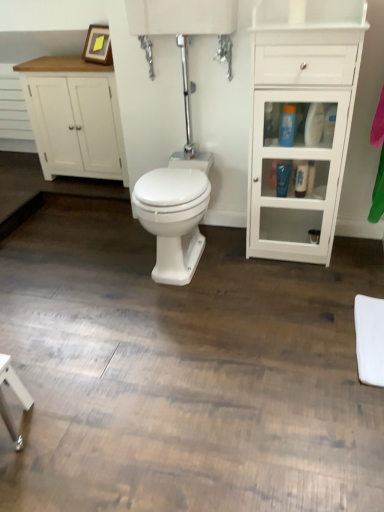
The height and width of the screenshot is (512, 384). I want to click on vacant space in front of white glossy cabinet at right, which is counted as the 2th bathroom cabinet, starting from the back, so click(x=295, y=286).